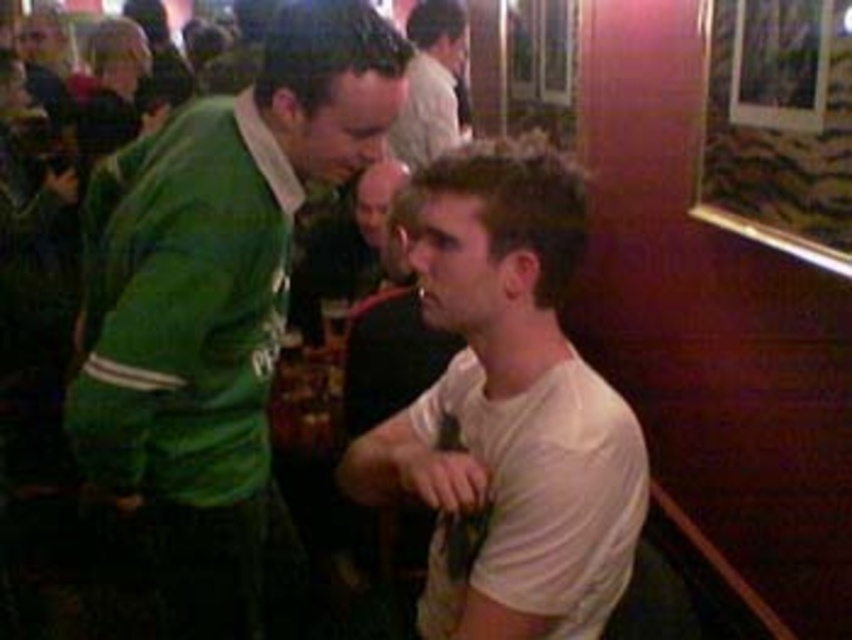
Is white matte shirt at center smaller than white t-shirt at center?

Correct, white matte shirt at center occupies less space than white t-shirt at center.

Is white matte shirt at center further to the viewer compared to white t-shirt at center?

No.

Is point (568, 529) closer to camera compared to point (412, 115)?

That is True.

This screenshot has width=852, height=640. Find the location of `white matte shirt at center`. white matte shirt at center is located at coordinates (510, 406).

Does green jersey at center have a smaller size compared to white t-shirt at center?

Incorrect, green jersey at center is not smaller in size than white t-shirt at center.

Is green jersey at center wider than white t-shirt at center?

Yes, green jersey at center is wider than white t-shirt at center.

What do you see at coordinates (217, 304) in the screenshot? I see `green jersey at center` at bounding box center [217, 304].

At what (x,y) coordinates should I click in order to perform the action: click on green jersey at center. Please return your answer as a coordinate pair (x, y). This screenshot has height=640, width=852. Looking at the image, I should click on (217, 304).

Can you confirm if green jersey at center is smaller than white matte shirt at center?

Incorrect, green jersey at center is not smaller in size than white matte shirt at center.

Is green jersey at center wider than white matte shirt at center?

Yes.

Is point (177, 570) positioned after point (522, 480)?

That is True.

Identify the location of green jersey at center. The height and width of the screenshot is (640, 852). (217, 304).